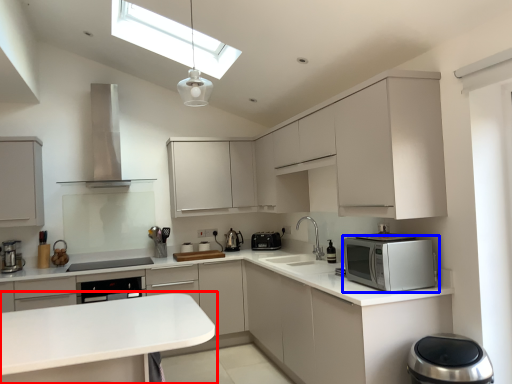
Question: Which of the following is the farthest to the observer, countertop (highlighted by a red box) or home appliance (highlighted by a blue box)?

Choices:
 (A) countertop
 (B) home appliance

Answer: (B)